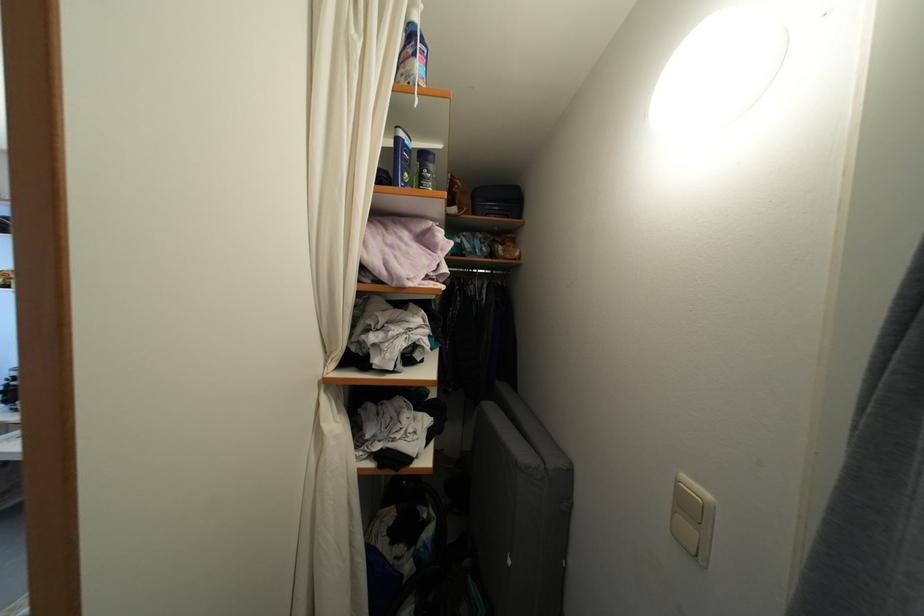
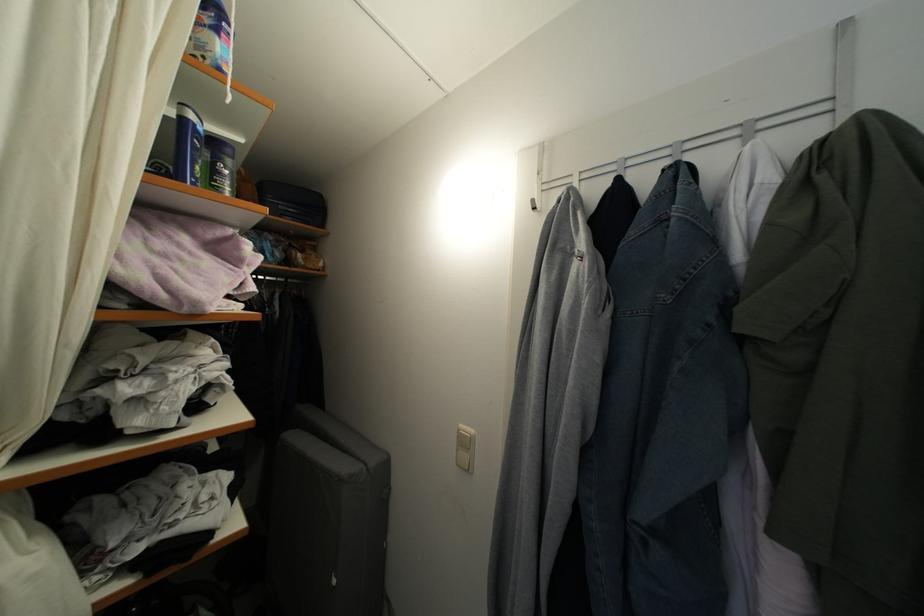
In the second image, find the point that corresponds to point (689, 483) in the first image.

(467, 432)